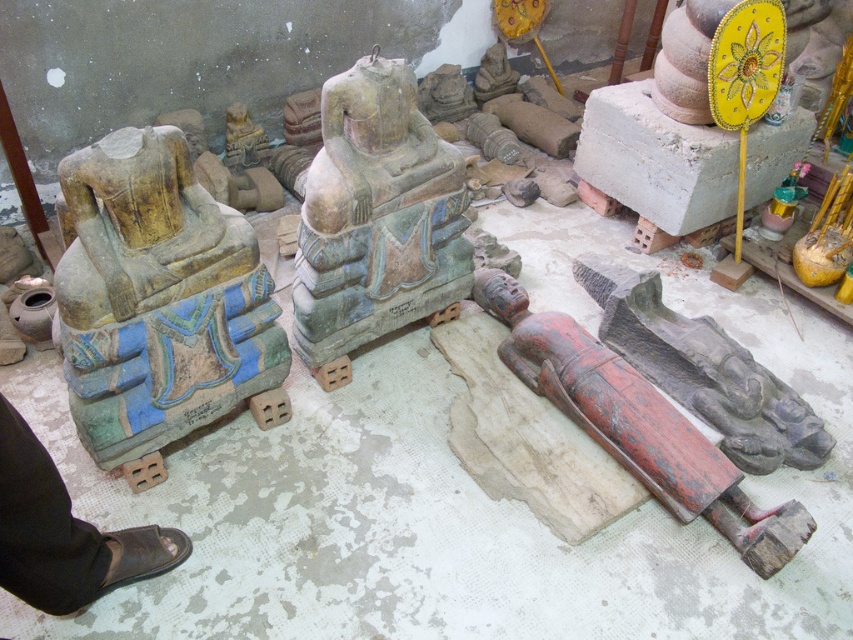
You are an art conservator assessing the storage area for these sculptures. Given that the yellowish stone statue at left is smaller than the green stone statue at center, which statue would require a larger protective crate for safe transportation?

The green stone statue at center requires a larger protective crate since it is bigger than the yellowish stone statue at left.

You are an art conservator tasked with moving the green stone statue at center and the red painted wood figure at lower right to a new exhibition space. The transport vehicle has a limited space capacity. Based on their sizes, which object should be moved first to ensure both can fit?

The green stone statue at center occupies less space than the red painted wood figure at lower right, so it should be moved first to accommodate the larger red painted wood figure at lower right in the transport vehicle.

From the picture: You are an art conservator standing at the entrance of the room. You need to assess the green stone statue at center. Based on its position, can you determine if it is centrally located in the room?

The green stone statue at center is located at point (375, 220), which is near the center coordinates of the room. Therefore, it can be considered centrally located.